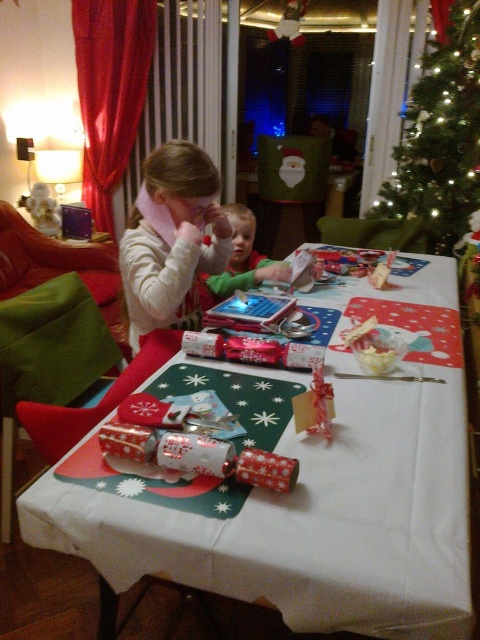
Question: Which point is farther to the camera?

Choices:
 (A) green textured christmas tree at upper right
 (B) white paper table at center
 (C) green matte shirt at center

Answer: (A)

Question: Does green textured christmas tree at upper right have a smaller size compared to green matte shirt at center?

Choices:
 (A) no
 (B) yes

Answer: (A)

Question: Which point is farther to the camera?

Choices:
 (A) (127, 540)
 (B) (433, 49)
 (C) (240, 282)

Answer: (B)

Question: Can you confirm if white paper table at center is positioned below green matte shirt at center?

Choices:
 (A) yes
 (B) no

Answer: (A)

Question: Which object is farther from the camera taking this photo?

Choices:
 (A) white paper table at center
 (B) green matte shirt at center
 (C) matte white sweater at upper left

Answer: (B)

Question: Can you confirm if white paper table at center is positioned to the left of matte white sweater at upper left?

Choices:
 (A) yes
 (B) no

Answer: (B)